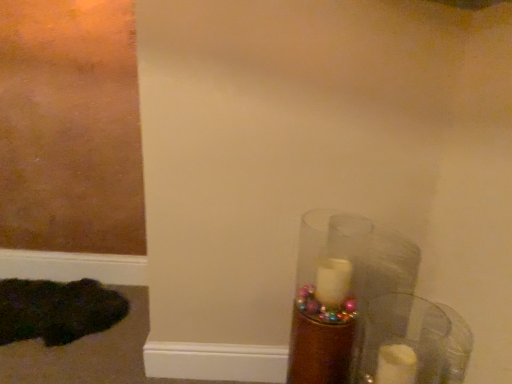
Question: Is dark green fur at lower left facing towards translucent glass candle at lower right?

Choices:
 (A) yes
 (B) no

Answer: (B)

Question: Considering the relative sizes of dark green fur at lower left and translucent glass candle at lower right in the image provided, is dark green fur at lower left taller than translucent glass candle at lower right?

Choices:
 (A) no
 (B) yes

Answer: (A)

Question: Is dark green fur at lower left at the left side of translucent glass candle at lower right?

Choices:
 (A) yes
 (B) no

Answer: (A)

Question: Does dark green fur at lower left have a lesser height compared to translucent glass candle at lower right?

Choices:
 (A) no
 (B) yes

Answer: (B)

Question: Is dark green fur at lower left wider than translucent glass candle at lower right?

Choices:
 (A) yes
 (B) no

Answer: (A)

Question: Relative to dark green fur at lower left, is translucent glass candle at lower right in front or behind?

Choices:
 (A) front
 (B) behind

Answer: (A)

Question: Is point (338, 311) positioned closer to the camera than point (17, 317)?

Choices:
 (A) farther
 (B) closer

Answer: (B)

Question: Visually, is translucent glass candle at lower right positioned to the left or to the right of dark green fur at lower left?

Choices:
 (A) right
 (B) left

Answer: (A)

Question: Is translucent glass candle at lower right bigger or smaller than dark green fur at lower left?

Choices:
 (A) small
 (B) big

Answer: (B)

Question: Considering the positions of transparent glass candle at right and dark green fur at lower left in the image, is transparent glass candle at right taller or shorter than dark green fur at lower left?

Choices:
 (A) short
 (B) tall

Answer: (B)

Question: Is transparent glass candle at right bigger or smaller than dark green fur at lower left?

Choices:
 (A) small
 (B) big

Answer: (A)

Question: Considering the positions of transparent glass candle at right and dark green fur at lower left in the image, is transparent glass candle at right wider or thinner than dark green fur at lower left?

Choices:
 (A) thin
 (B) wide

Answer: (A)

Question: Does point (395, 336) appear closer or farther from the camera than point (12, 319)?

Choices:
 (A) farther
 (B) closer

Answer: (B)

Question: From the image's perspective, is dark green fur at lower left located above or below translucent glass candle at lower right?

Choices:
 (A) above
 (B) below

Answer: (B)

Question: In terms of width, does dark green fur at lower left look wider or thinner when compared to translucent glass candle at lower right?

Choices:
 (A) thin
 (B) wide

Answer: (B)